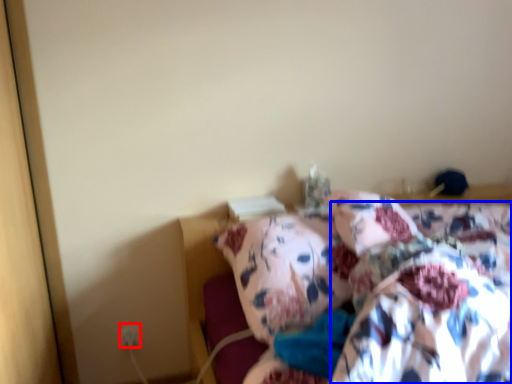
Question: Which object is further to the camera taking this photo, electric outlet (highlighted by a red box) or blanket (highlighted by a blue box)?

Choices:
 (A) electric outlet
 (B) blanket

Answer: (A)